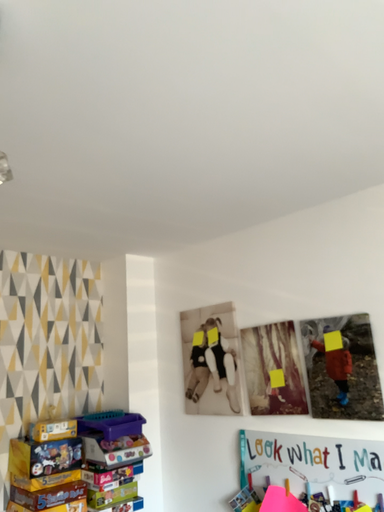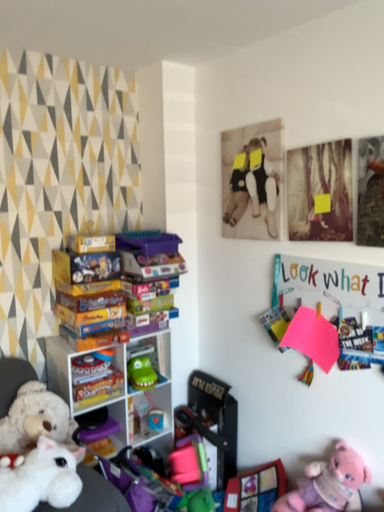
Question: How did the camera likely rotate when shooting the video?

Choices:
 (A) rotated upward
 (B) rotated downward

Answer: (B)